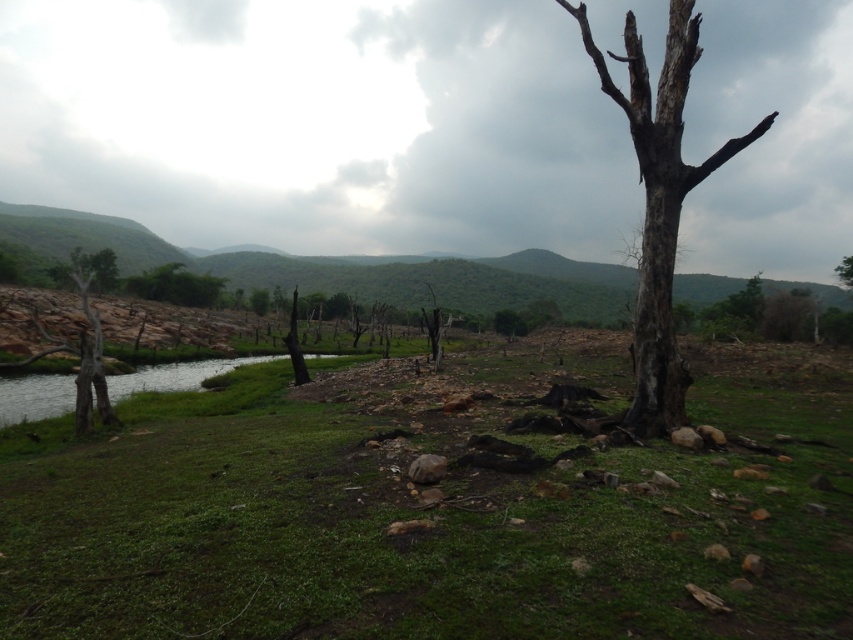
You are standing at the burnt tree stump in the foreground and want to walk to the water in the middle ground. There are two points marked on your path. Which point, point [844,620] or point [688,17], is closer to you as you start your journey?

Point [844,620] is closer to you than point [688,17] because it is closer to the camera, which means it is nearer to your starting position at the burnt tree stump.

You are a hiker trying to cross the stream. You see the green grassy hillside at center and the brown rough tree at center. Which path is wider for your hiking gear?

The green grassy hillside at center is wider than the brown rough tree at center, so the path through the green grassy hillside at center is wider for your hiking gear.